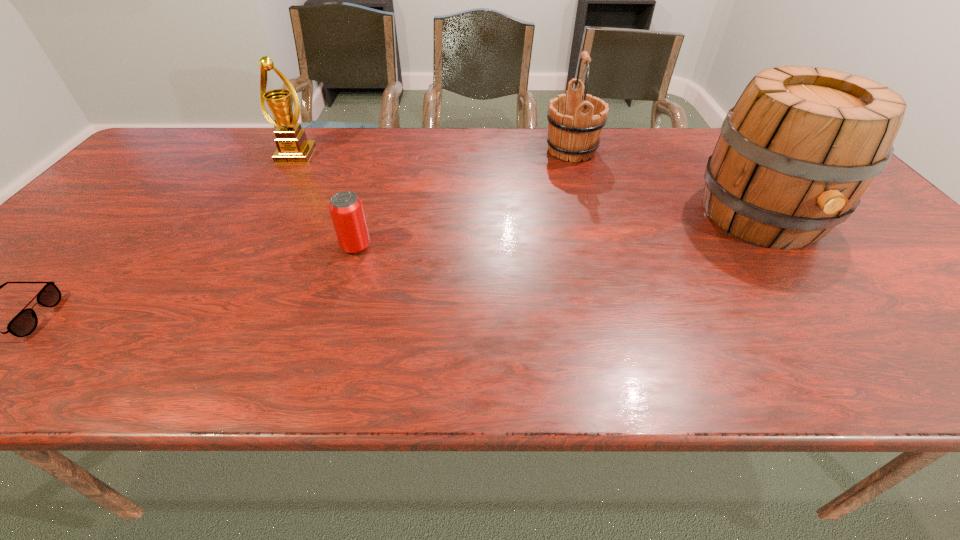
In order to click on wine bucket that is at the far edge in this screenshot , I will do `click(575, 126)`.

I want to click on object at the right edge, so click(800, 147).

Find the location of `vacant region at the far edge of the desktop`. vacant region at the far edge of the desktop is located at coordinates (443, 126).

The image size is (960, 540). I want to click on vacant space at the near edge of the desktop, so click(x=426, y=343).

Where is `free location at the left edge`? free location at the left edge is located at coordinates (85, 241).

Find the location of a particular element. This screenshot has width=960, height=540. vacant space at the right edge of the desktop is located at coordinates (895, 289).

Find the location of a particular element. free point between the fourth object from left to right and the second object from left to right is located at coordinates (434, 153).

The image size is (960, 540). Identify the location of free space between the award and the fourth object from left to right. (434, 153).

The image size is (960, 540). What are the coordinates of `vacant space in between the fourth tallest object and the award` in the screenshot? It's located at (326, 201).

Find the location of `blank region between the second shortest object and the award`. blank region between the second shortest object and the award is located at coordinates (326, 201).